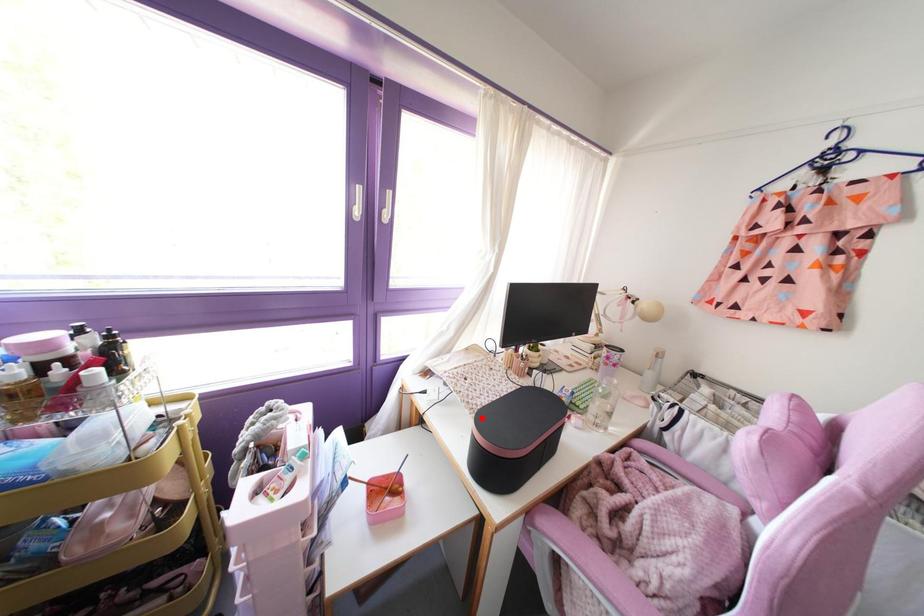
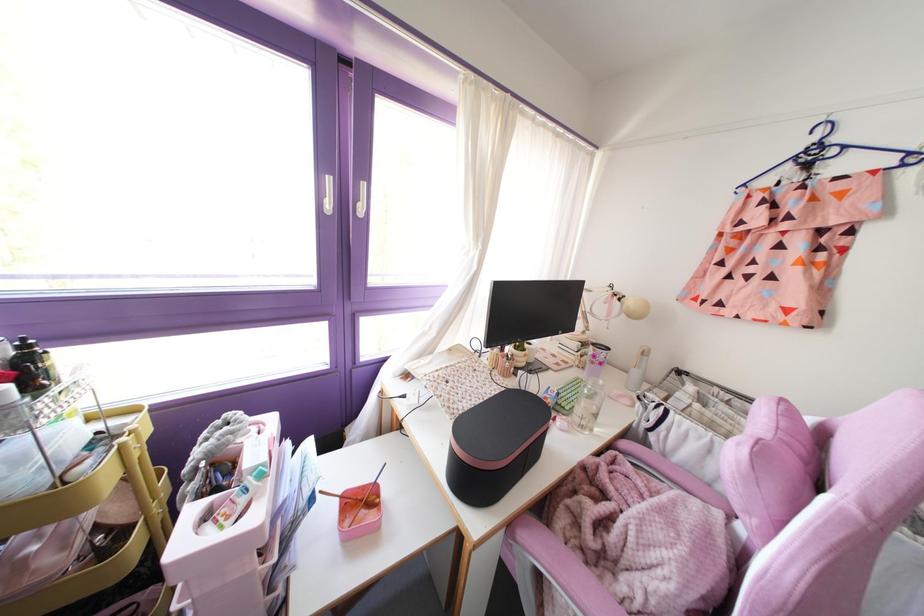
Find the pixel in the second image that matches the highlighted location in the first image.

(459, 426)